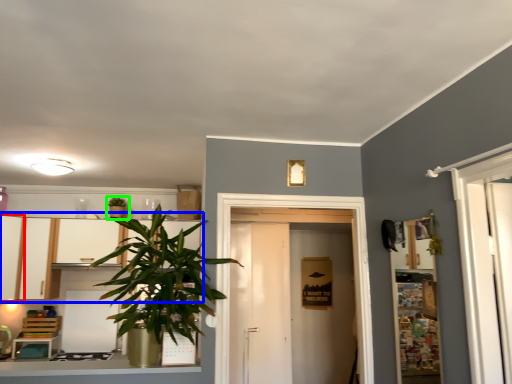
Question: Which object is positioned closest to cabinetry (highlighted by a red box)? Select from dresser (highlighted by a blue box) and houseplant (highlighted by a green box).

Choices:
 (A) dresser
 (B) houseplant

Answer: (A)